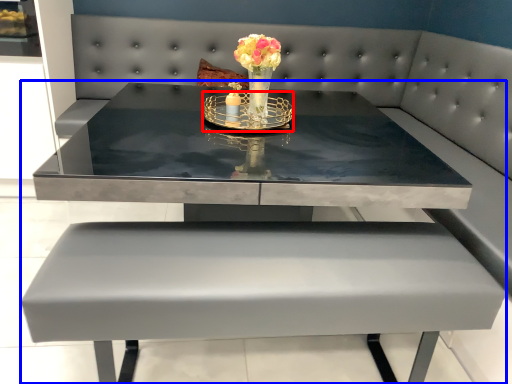
Question: Which object appears farthest to the camera in this image, candle holder (highlighted by a red box) or table (highlighted by a blue box)?

Choices:
 (A) candle holder
 (B) table

Answer: (A)